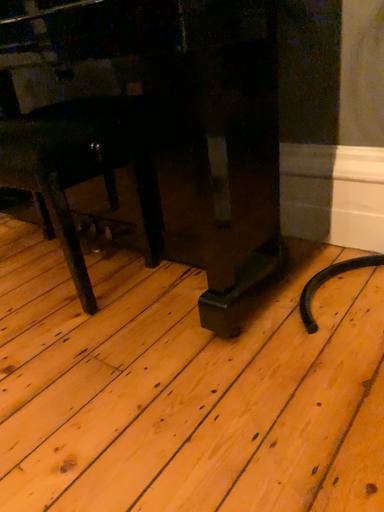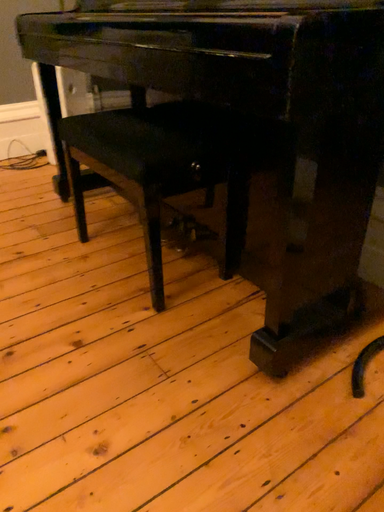
Question: How did the camera likely rotate when shooting the video?

Choices:
 (A) rotated left
 (B) rotated right

Answer: (A)